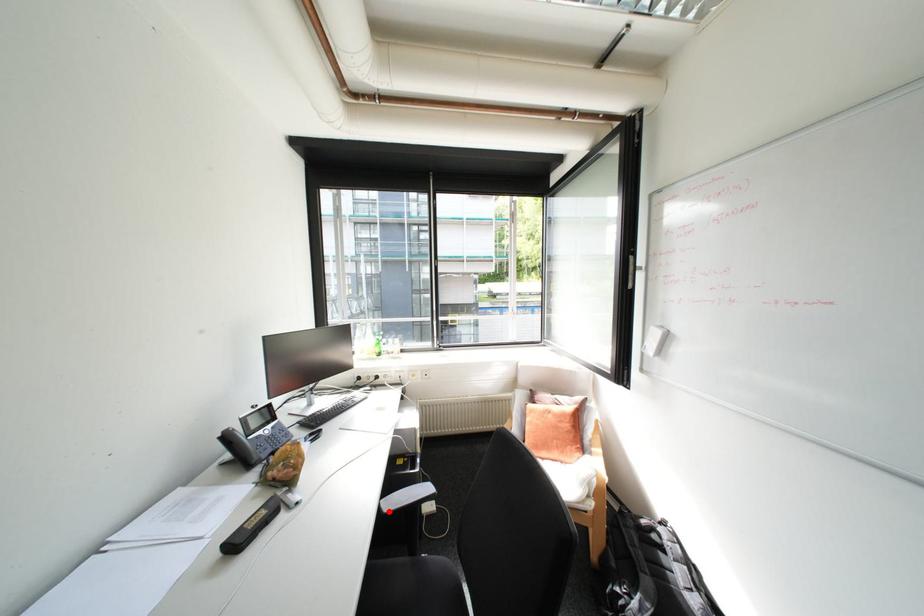
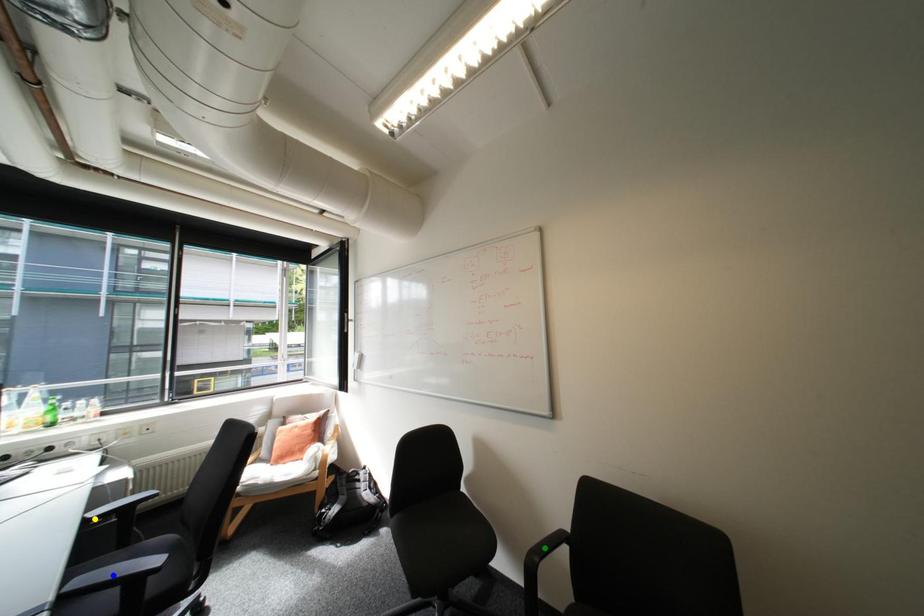
Question: I am providing you with two images of the same scene from different viewpoints. A red point is marked on the first image. You are given multiple points on the second image. Which mark in image 2 goes with the point in image 1?

Choices:
 (A) yellow point
 (B) blue point
 (C) green point

Answer: (A)